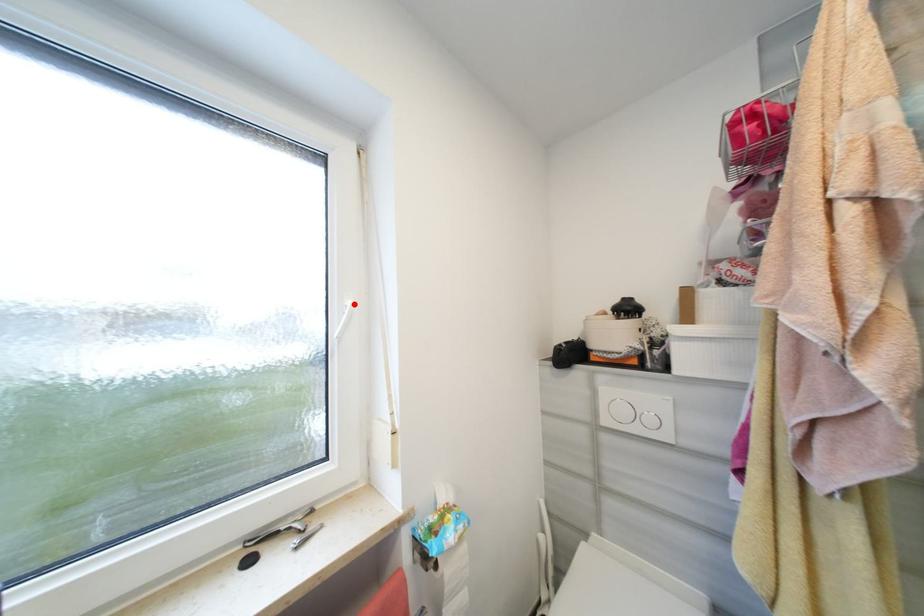
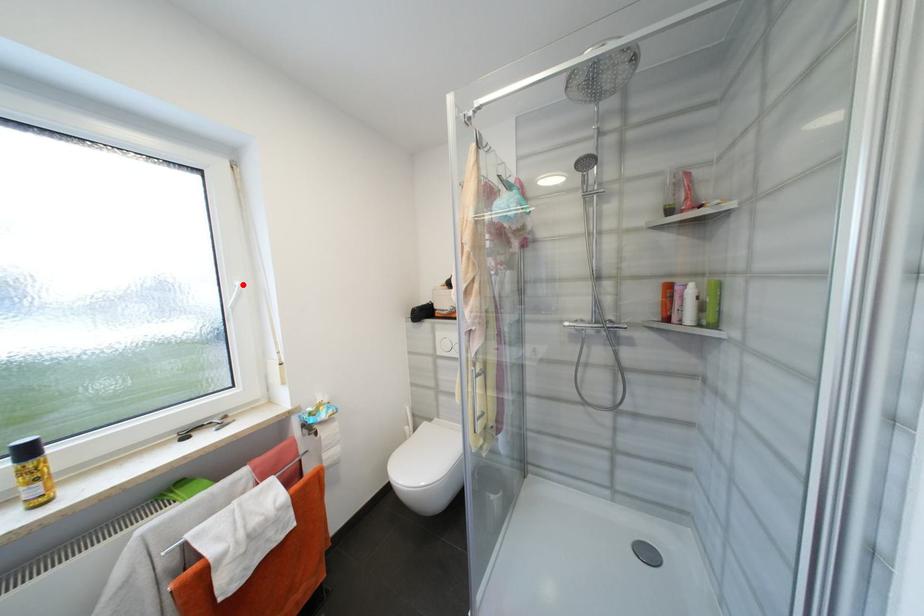
I am providing you with two images of the same scene from different viewpoints. A red point is marked on the first image and another point is marked on the second image. Do the highlighted points in image1 and image2 indicate the same real-world spot?

Yes